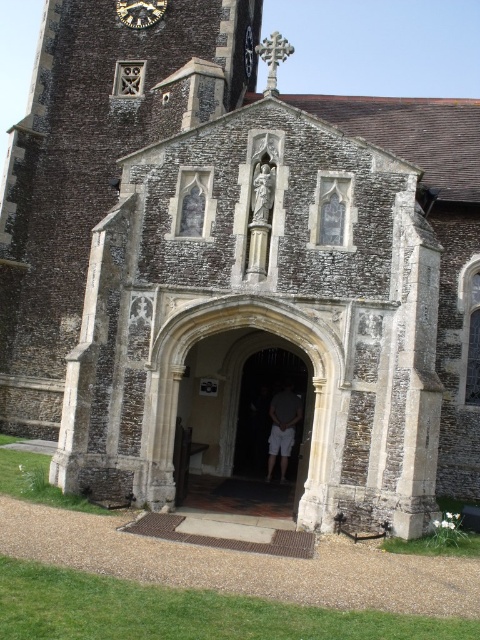
Is point (291, 388) farther from camera compared to point (123, 1)?

No, (291, 388) is in front of (123, 1).

This screenshot has height=640, width=480. I want to click on light gray cotton shorts at center, so click(283, 428).